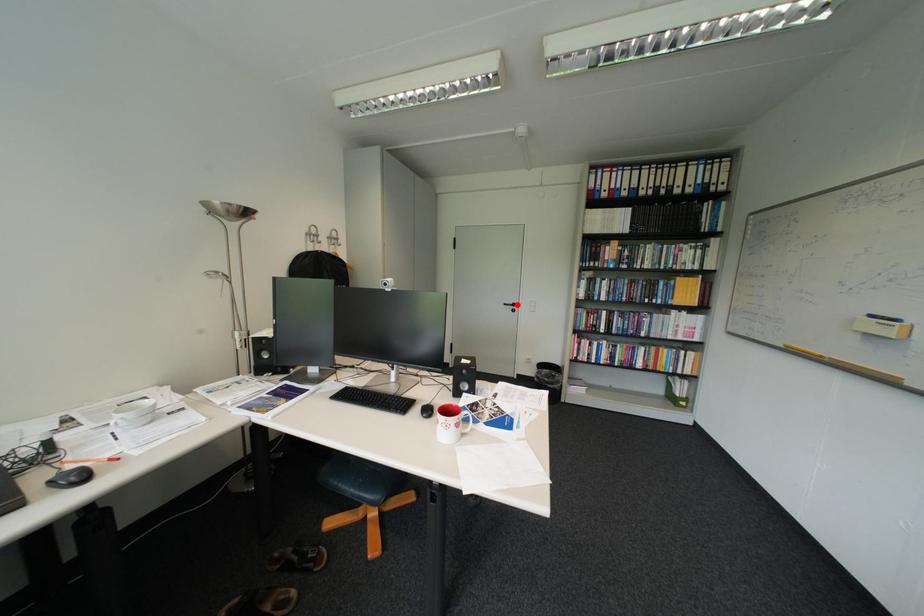
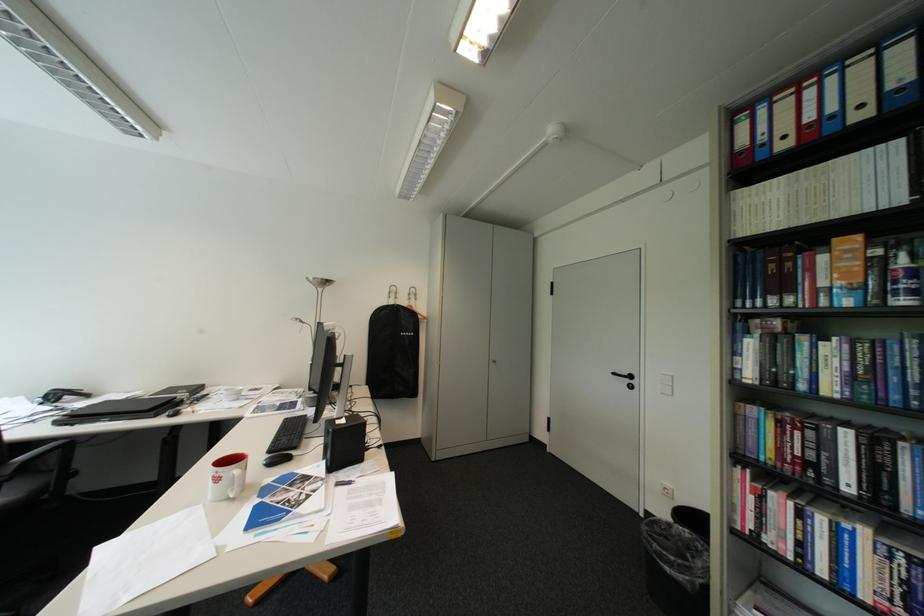
Where in the second image is the point corresponding to the highlighted location from the first image?

(626, 374)